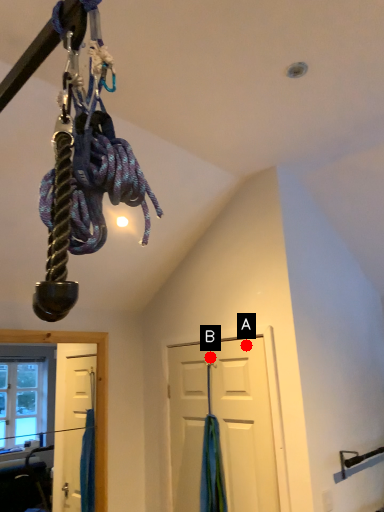
Question: Two points are circled on the image, labeled by A and B beside each circle. Which point is farther from the camera taking this photo?

Choices:
 (A) A is further
 (B) B is further

Answer: (B)